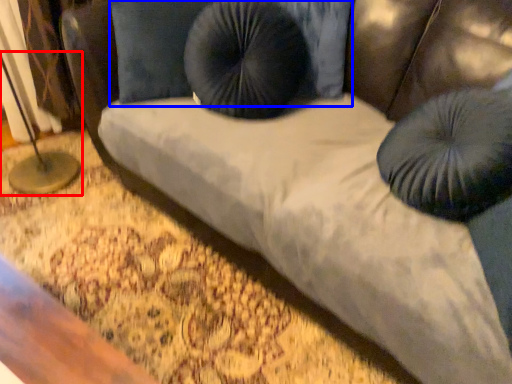
Question: Which object is further to the camera taking this photo, table lamp (highlighted by a red box) or pillow (highlighted by a blue box)?

Choices:
 (A) table lamp
 (B) pillow

Answer: (A)